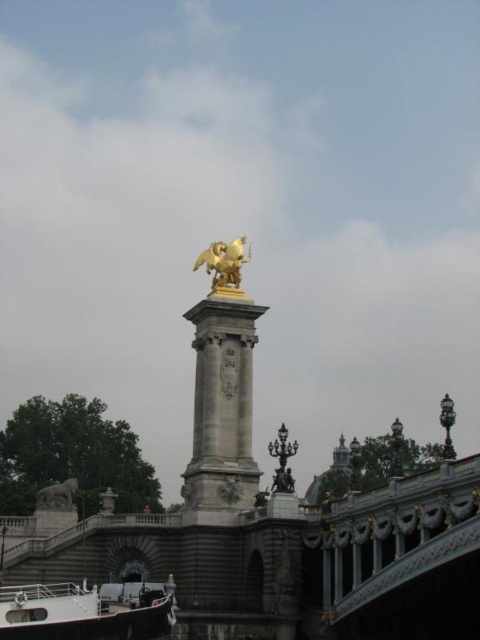
Question: Which of the following is the closest to the observer?

Choices:
 (A) gold polished statue at center
 (B) white matte boat at lower left
 (C) gold polished statue at upper center

Answer: (B)

Question: Estimate the real-world distances between objects in this image. Which object is closer to the gold polished statue at upper center?

Choices:
 (A) gold polished statue at center
 (B) white matte boat at lower left

Answer: (A)

Question: Does white matte boat at lower left have a lesser width compared to gold polished statue at upper center?

Choices:
 (A) yes
 (B) no

Answer: (B)

Question: Which point is closer to the camera?

Choices:
 (A) gold polished statue at upper center
 (B) white matte boat at lower left

Answer: (B)

Question: Is white matte boat at lower left wider than gold polished statue at upper center?

Choices:
 (A) no
 (B) yes

Answer: (B)

Question: Considering the relative positions of gold polished statue at center and gold polished statue at upper center in the image provided, where is gold polished statue at center located with respect to gold polished statue at upper center?

Choices:
 (A) below
 (B) above

Answer: (A)